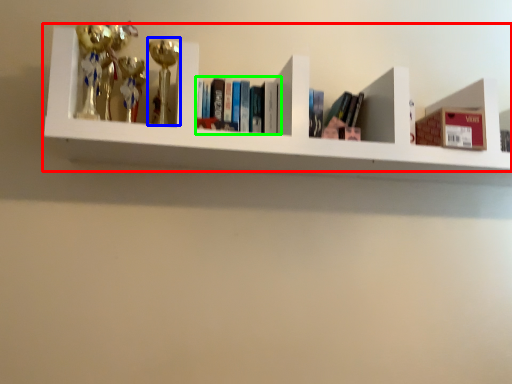
Question: Considering the real-world distances, which object is closest to shelf (highlighted by a red box)? toy (highlighted by a blue box) or book (highlighted by a green box).

Choices:
 (A) toy
 (B) book

Answer: (B)